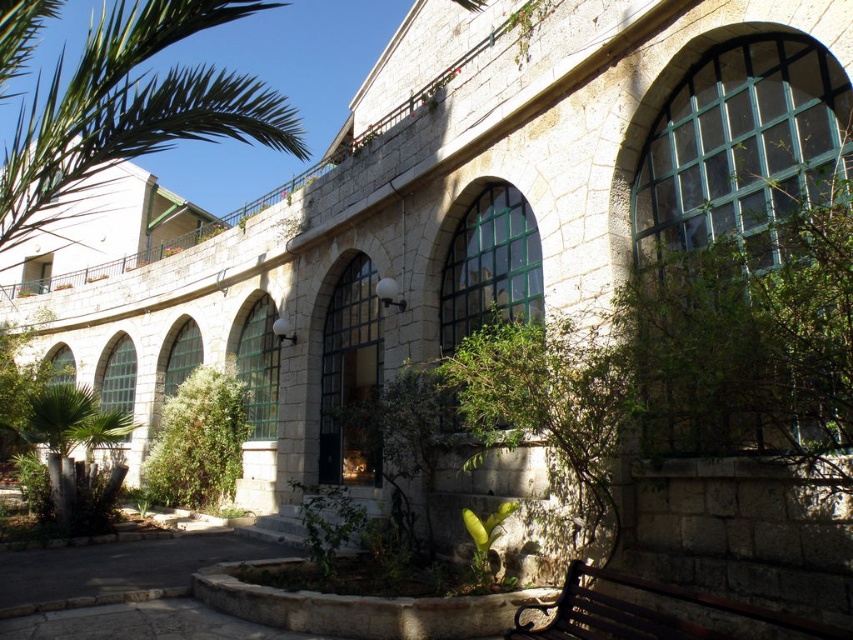
Who is higher up, green leafy palm at upper left or dark brown wooden bench at lower right?

green leafy palm at upper left is higher up.

Does green leafy palm at upper left have a greater height compared to dark brown wooden bench at lower right?

Correct, green leafy palm at upper left is much taller as dark brown wooden bench at lower right.

Is point (84, 145) farther from camera compared to point (573, 627)?

Yes.

Where is `green leafy palm at upper left`? The height and width of the screenshot is (640, 853). green leafy palm at upper left is located at coordinates (132, 108).